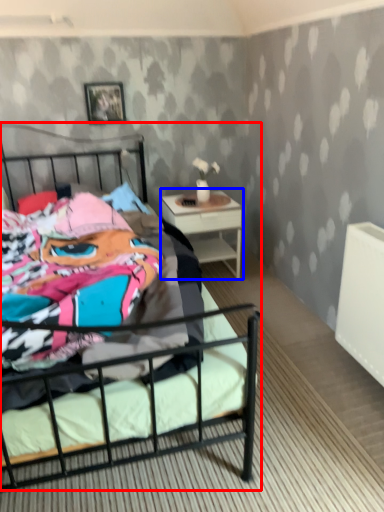
Question: Among these objects, which one is nearest to the camera, bed (highlighted by a red box) or nightstand (highlighted by a blue box)?

Choices:
 (A) bed
 (B) nightstand

Answer: (A)